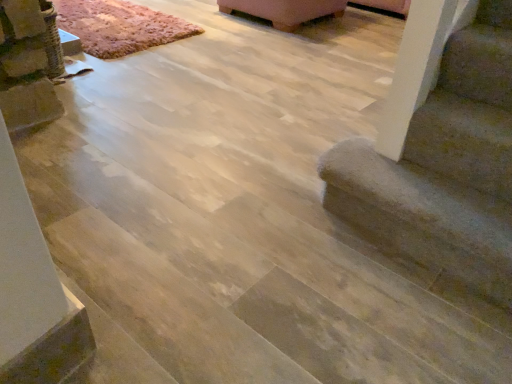
Question: Considering the relative positions of smooth concrete stairs at lower right and rustic wool rug at upper left in the image provided, is smooth concrete stairs at lower right to the left or to the right of rustic wool rug at upper left?

Choices:
 (A) right
 (B) left

Answer: (A)

Question: In terms of height, does smooth concrete stairs at lower right look taller or shorter compared to rustic wool rug at upper left?

Choices:
 (A) tall
 (B) short

Answer: (A)

Question: Considering the positions of point (481, 56) and point (126, 13), is point (481, 56) closer or farther from the camera than point (126, 13)?

Choices:
 (A) closer
 (B) farther

Answer: (A)

Question: Is rustic wool rug at upper left situated inside smooth concrete stairs at lower right or outside?

Choices:
 (A) inside
 (B) outside

Answer: (B)

Question: From their relative heights in the image, would you say rustic wool rug at upper left is taller or shorter than smooth concrete stairs at lower right?

Choices:
 (A) tall
 (B) short

Answer: (B)

Question: Is point (167, 19) positioned closer to the camera than point (508, 289)?

Choices:
 (A) farther
 (B) closer

Answer: (A)

Question: Based on their sizes in the image, would you say rustic wool rug at upper left is bigger or smaller than smooth concrete stairs at lower right?

Choices:
 (A) big
 (B) small

Answer: (A)